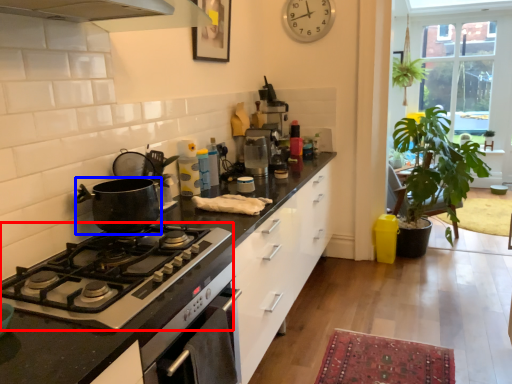
Question: Among these objects, which one is farthest to the camera, gas stove (highlighted by a red box) or kitchen appliance (highlighted by a blue box)?

Choices:
 (A) gas stove
 (B) kitchen appliance

Answer: (B)